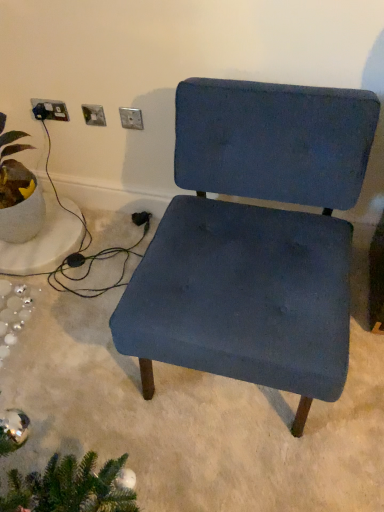
Question: Does matte ceramic plant at left lie behind satin silver socket at upper center, acting as the second electric outlet starting from the left?

Choices:
 (A) yes
 (B) no

Answer: (B)

Question: Is satin silver socket at upper center, which appears as the second electric outlet when viewed from the right, at the back of matte ceramic plant at left?

Choices:
 (A) yes
 (B) no

Answer: (B)

Question: Can you see matte ceramic plant at left touching satin silver socket at upper center, which appears as the second electric outlet when viewed from the right?

Choices:
 (A) yes
 (B) no

Answer: (B)

Question: Can you confirm if matte ceramic plant at left is positioned to the left of satin silver socket at upper center, which appears as the second electric outlet when viewed from the right?

Choices:
 (A) yes
 (B) no

Answer: (A)

Question: Is matte ceramic plant at left closer to camera compared to satin silver socket at upper center, acting as the second electric outlet starting from the left?

Choices:
 (A) no
 (B) yes

Answer: (B)

Question: Is satin silver socket at upper left, positioned as the third electric outlet in right-to-left order, bigger or smaller than metallic silver outlet at upper center, the 1th electric outlet from the right?

Choices:
 (A) big
 (B) small

Answer: (A)

Question: Visually, is satin silver socket at upper left, the 1th electric outlet when ordered from left to right, positioned to the left or to the right of metallic silver outlet at upper center, the 1th electric outlet from the right?

Choices:
 (A) right
 (B) left

Answer: (B)

Question: In the image, is satin silver socket at upper left, positioned as the third electric outlet in right-to-left order, positioned in front of or behind metallic silver outlet at upper center, the third electric outlet when ordered from left to right?

Choices:
 (A) front
 (B) behind

Answer: (B)

Question: Is point pyautogui.click(x=52, y=104) positioned closer to the camera than point pyautogui.click(x=137, y=128)?

Choices:
 (A) closer
 (B) farther

Answer: (B)

Question: From the image's perspective, relative to matte ceramic plant at left, is satin silver socket at upper center, which appears as the second electric outlet when viewed from the right, above or below?

Choices:
 (A) above
 (B) below

Answer: (A)

Question: Is point (97, 112) closer or farther from the camera than point (13, 159)?

Choices:
 (A) farther
 (B) closer

Answer: (B)

Question: Considering the positions of satin silver socket at upper center, acting as the second electric outlet starting from the left, and matte ceramic plant at left in the image, is satin silver socket at upper center, acting as the second electric outlet starting from the left, wider or thinner than matte ceramic plant at left?

Choices:
 (A) thin
 (B) wide

Answer: (A)

Question: Considering the positions of satin silver socket at upper center, which appears as the second electric outlet when viewed from the right, and matte ceramic plant at left in the image, is satin silver socket at upper center, which appears as the second electric outlet when viewed from the right, bigger or smaller than matte ceramic plant at left?

Choices:
 (A) small
 (B) big

Answer: (A)

Question: In terms of width, does matte ceramic plant at left look wider or thinner when compared to velvet blue chair at center?

Choices:
 (A) wide
 (B) thin

Answer: (B)

Question: Is point (14, 202) closer or farther from the camera than point (114, 310)?

Choices:
 (A) closer
 (B) farther

Answer: (B)